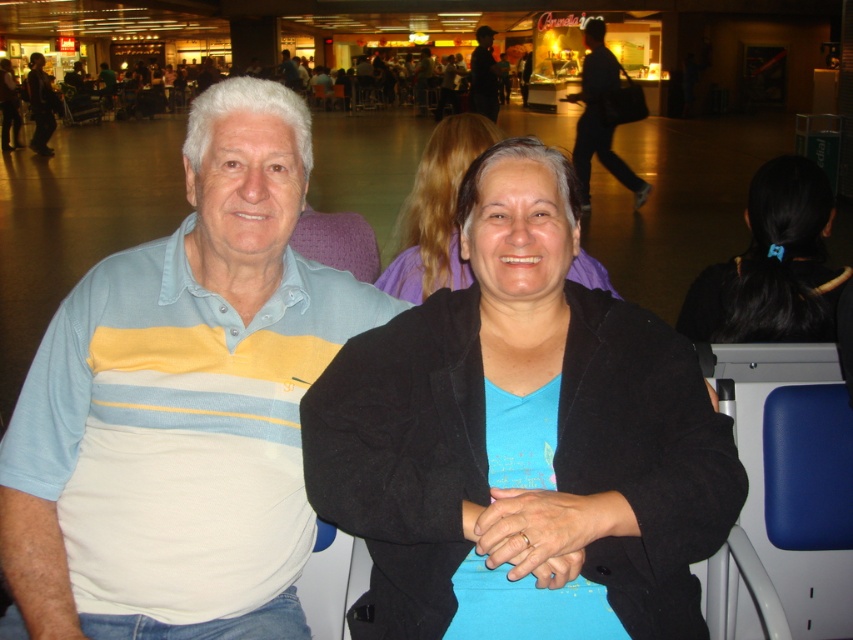
You are a photographer trying to capture a clear shot of the light blue and yellow striped polo shirt at center and the light blue striped polo shirt at center. Which one is blocking the other?

The light blue and yellow striped polo shirt at center is in front of the light blue striped polo shirt at center, so it is blocking the other.

You are standing at the entrance of the market and want to find the blue matte jacket at center. According to the coordinates provided, where should you look relative to your current position?

The blue matte jacket at center is located at coordinates point (436, 211), which means it is positioned to the left and slightly forward from your current position at the entrance.

You are a photographer trying to capture a clear shot of the black hair at upper right and the blue matte jacket at center. Based on their positions, which object is more likely to block the other when adjusting your camera angle?

The black hair at upper right might be wider than blue matte jacket at center, so it could potentially block the jacket if positioned between the camera and the jacket.